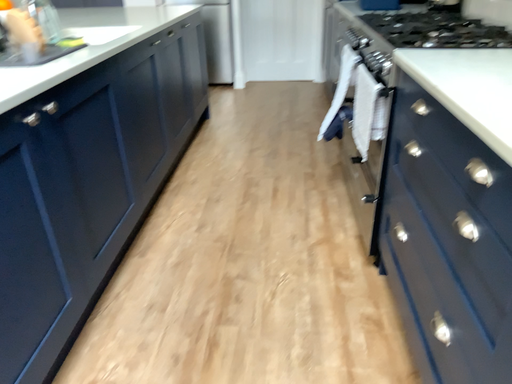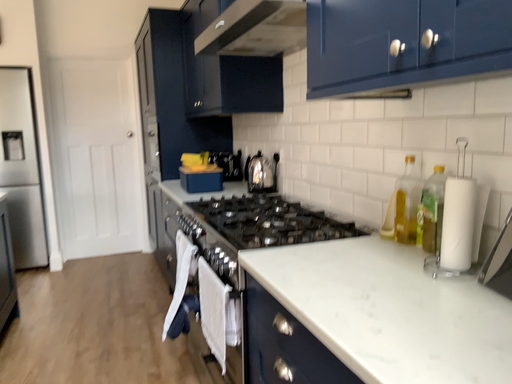
Question: Which way did the camera rotate in the video?

Choices:
 (A) rotated right
 (B) rotated left

Answer: (A)